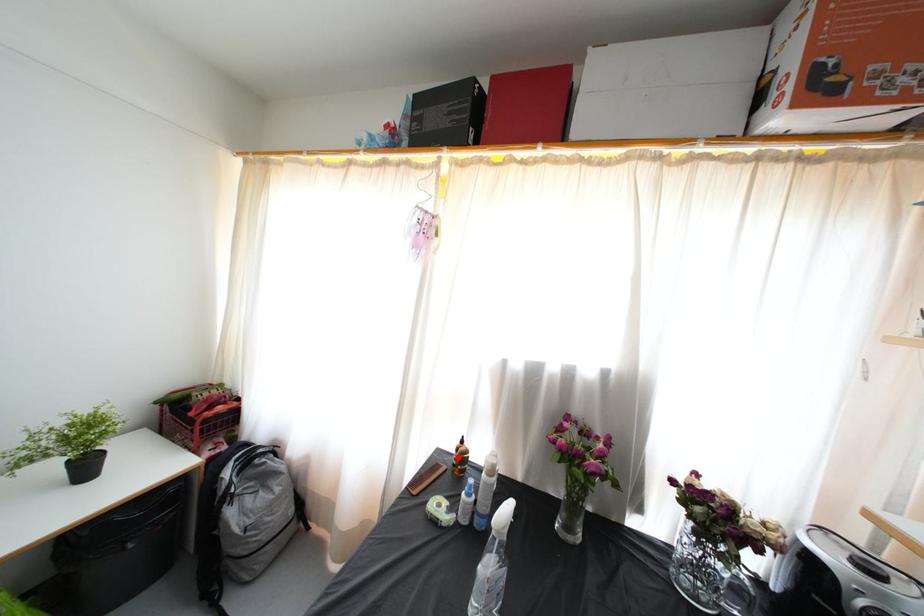
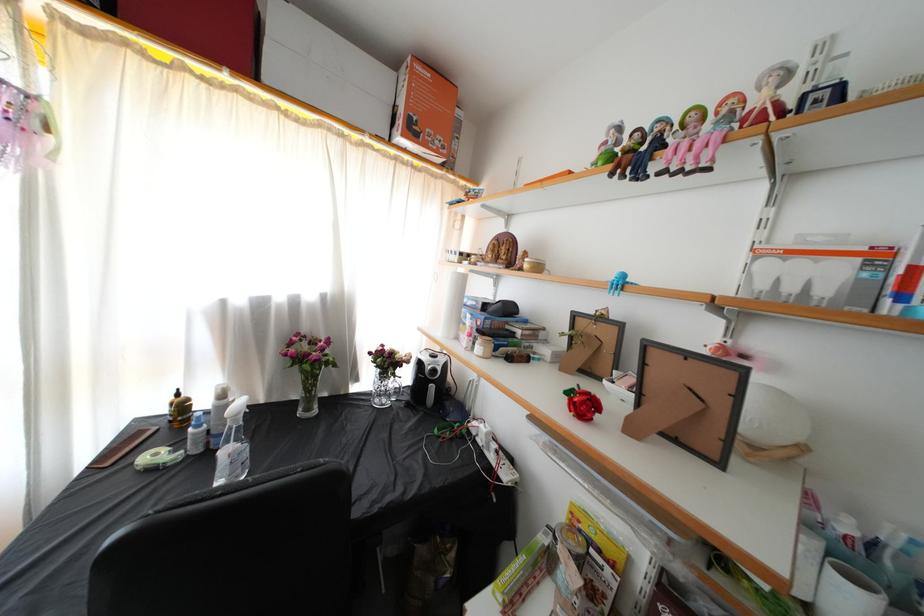
Locate, in the second image, the point that corresponds to the highlighted location in the first image.

(171, 416)